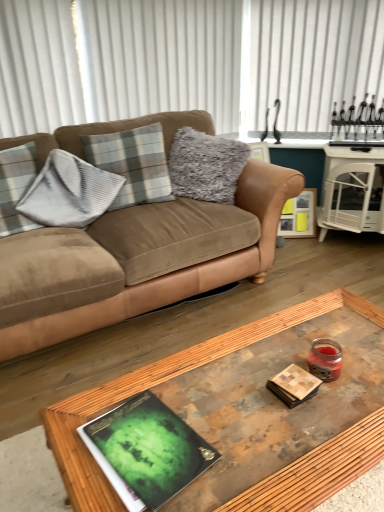
I want to click on vacant area on top of wooden glass coffee table at center (from a real-world perspective), so (270, 382).